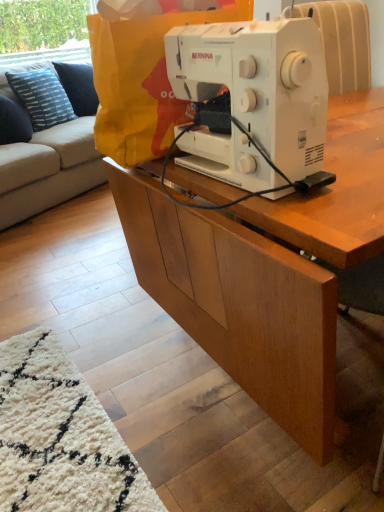
Question: Are blue striped fabric pillow at upper left and white plastic sewing machine at center making contact?

Choices:
 (A) yes
 (B) no

Answer: (B)

Question: Is blue striped fabric pillow at upper left completely or partially outside of white plastic sewing machine at center?

Choices:
 (A) yes
 (B) no

Answer: (A)

Question: Would you consider blue striped fabric pillow at upper left to be distant from white plastic sewing machine at center?

Choices:
 (A) yes
 (B) no

Answer: (A)

Question: From a real-world perspective, is blue striped fabric pillow at upper left located beneath white plastic sewing machine at center?

Choices:
 (A) no
 (B) yes

Answer: (B)

Question: Can you confirm if blue striped fabric pillow at upper left is bigger than white plastic sewing machine at center?

Choices:
 (A) no
 (B) yes

Answer: (B)

Question: Can you confirm if blue striped fabric pillow at upper left is positioned to the right of white plastic sewing machine at center?

Choices:
 (A) no
 (B) yes

Answer: (A)

Question: Is blue striped fabric pillow at upper left oriented towards light gray fabric couch at upper left?

Choices:
 (A) no
 (B) yes

Answer: (B)

Question: Does blue striped fabric pillow at upper left come behind light gray fabric couch at upper left?

Choices:
 (A) no
 (B) yes

Answer: (B)

Question: From the image's perspective, is blue striped fabric pillow at upper left under light gray fabric couch at upper left?

Choices:
 (A) yes
 (B) no

Answer: (B)

Question: Is blue striped fabric pillow at upper left outside light gray fabric couch at upper left?

Choices:
 (A) yes
 (B) no

Answer: (B)

Question: Is light gray fabric couch at upper left located within blue striped fabric pillow at upper left?

Choices:
 (A) yes
 (B) no

Answer: (B)

Question: Considering the relative sizes of blue striped fabric pillow at upper left and light gray fabric couch at upper left in the image provided, is blue striped fabric pillow at upper left bigger than light gray fabric couch at upper left?

Choices:
 (A) no
 (B) yes

Answer: (A)

Question: From the image's perspective, is wooden cabinet at center located above yellow paper bag at center?

Choices:
 (A) no
 (B) yes

Answer: (A)